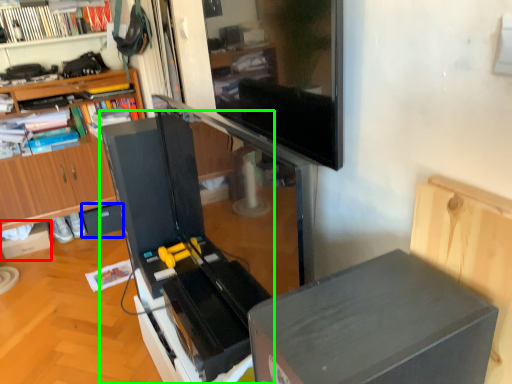
Question: Which is nearer to the cardboard box (highlighted by a red box)? drawer (highlighted by a blue box) or appliance (highlighted by a green box).

Choices:
 (A) drawer
 (B) appliance

Answer: (A)